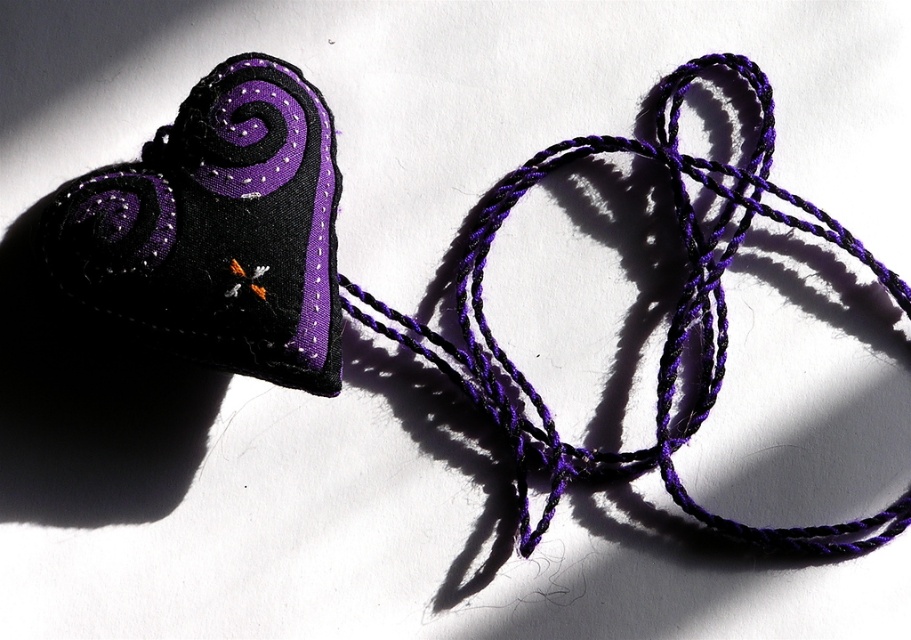
You are an artist trying to create a balanced composition. You have the matte black fabric heart at upper left and the purple twisted string at center. Which object takes up more visual space in the image?

The purple twisted string at center occupies more visual space than the matte black fabric heart at upper left.

You are an artist trying to hang the matte black fabric heart at upper left and the purple twisted string at center on a wall. Which object should you place higher to ensure they are aligned properly?

The purple twisted string at center is taller than the matte black fabric heart at upper left, so you should place the matte black fabric heart at upper left higher to align their tops properly.

Consider the image. You are an artist who wants to hang the matte black fabric heart at upper left and the purple twisted string at center on a gallery wall. Based on the scene, which object should be placed higher to maintain the original composition?

The matte black fabric heart at upper left should be placed higher because it is positioned over the purple twisted string at center in the original scene.